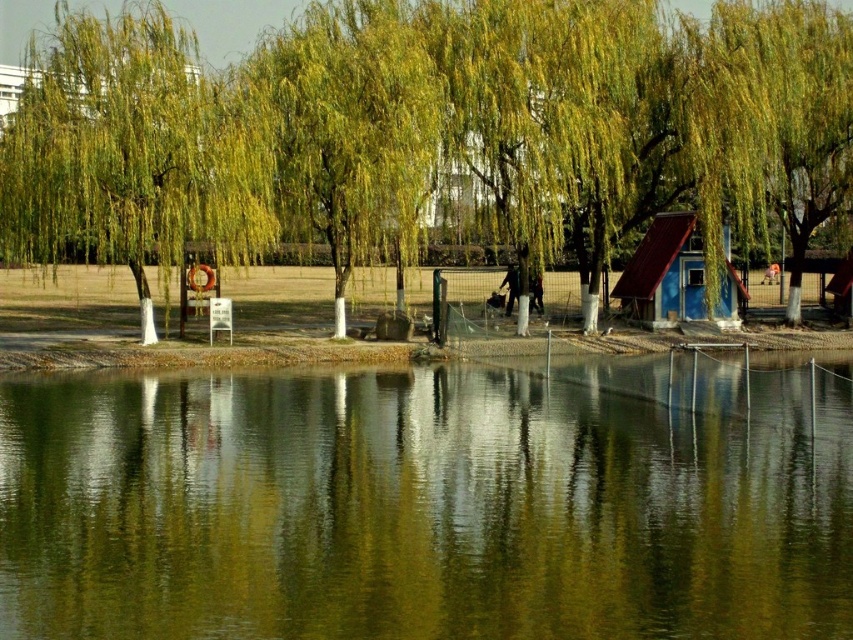
Question: Which is farther from the green reflective water at center?

Choices:
 (A) green leafy willow at left
 (B) green leafy willow at right

Answer: (A)

Question: Is green leafy willow at left bigger than green leafy tree at center?

Choices:
 (A) no
 (B) yes

Answer: (A)

Question: Which object is closer to the camera taking this photo?

Choices:
 (A) blue painted wood hut at right
 (B) green leafy willow at right

Answer: (B)

Question: Which of the following is the farthest from the observer?

Choices:
 (A) green leafy willow at left
 (B) green reflective water at center

Answer: (A)

Question: Can you confirm if green leafy willow at right is positioned above blue painted wood hut at right?

Choices:
 (A) yes
 (B) no

Answer: (A)

Question: Can you confirm if green reflective water at center is wider than green leafy willow at right?

Choices:
 (A) yes
 (B) no

Answer: (A)